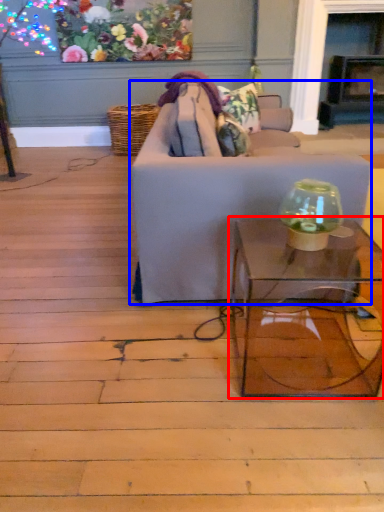
Question: Which point is further to the camera, table (highlighted by a red box) or studio couch (highlighted by a blue box)?

Choices:
 (A) table
 (B) studio couch

Answer: (B)